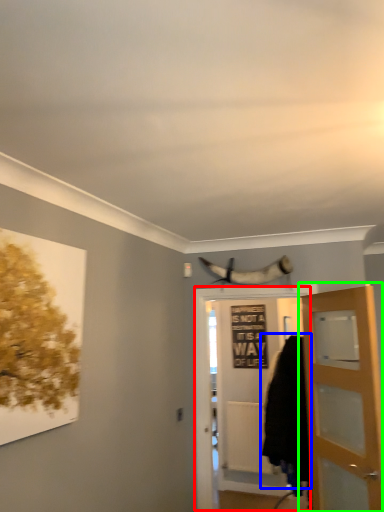
Question: Estimate the real-world distances between objects in this image. Which object is farther from door (highlighted by a red box), cloak (highlighted by a blue box) or door (highlighted by a green box)?

Choices:
 (A) cloak
 (B) door

Answer: (B)